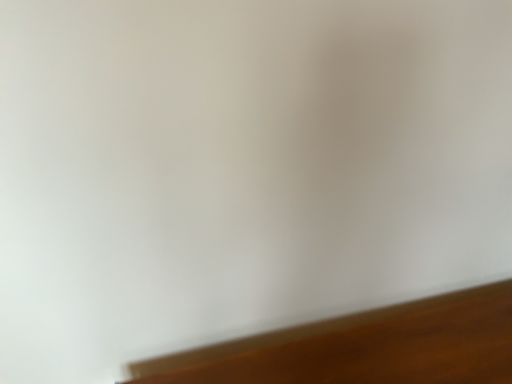
This screenshot has width=512, height=384. What do you see at coordinates (362, 347) in the screenshot? I see `brown wood floor at lower right` at bounding box center [362, 347].

The width and height of the screenshot is (512, 384). Find the location of `brown wood floor at lower right`. brown wood floor at lower right is located at coordinates (362, 347).

Measure the distance between point (244, 361) and camera.

Point (244, 361) and camera are 3.55 feet apart.

Identify the location of brown wood floor at lower right. (362, 347).